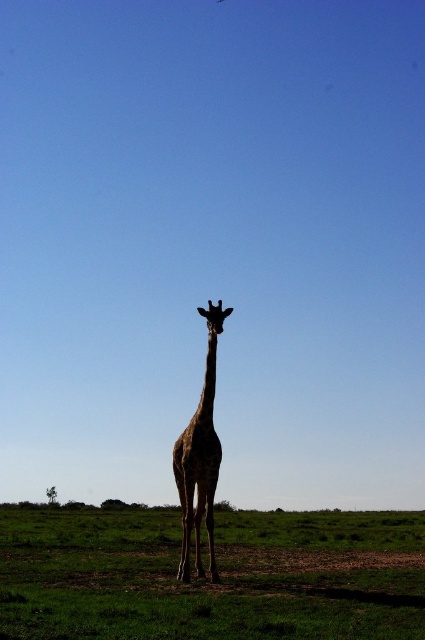
Is point (351, 614) in front of point (197, 502)?

Yes, it is.

Who is lower down, green grass at center or spotted fur giraffe at center?

green grass at center is lower down.

Which is in front, point (67, 531) or point (207, 397)?

Point (207, 397)

What are the coordinates of `green grass at center` in the screenshot? It's located at (207, 580).